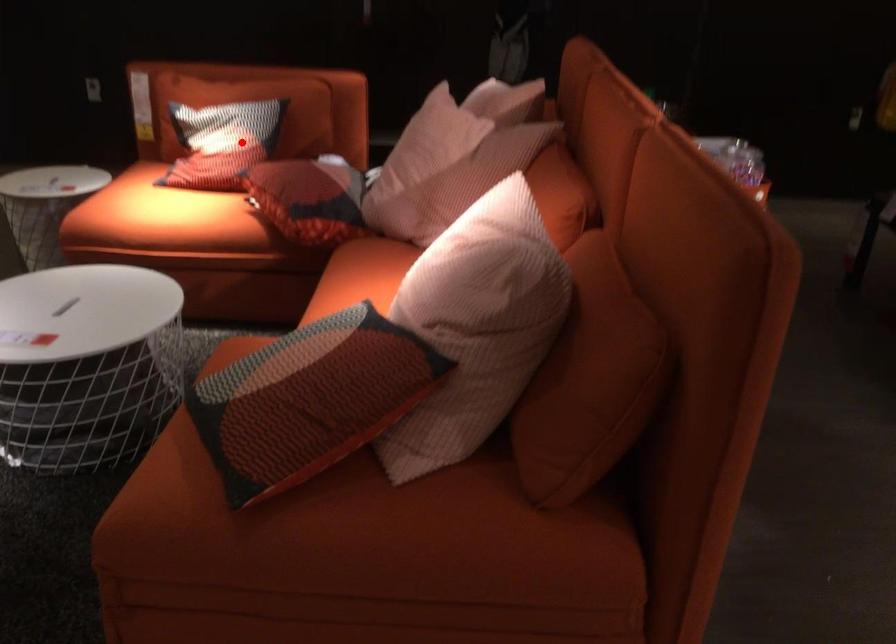
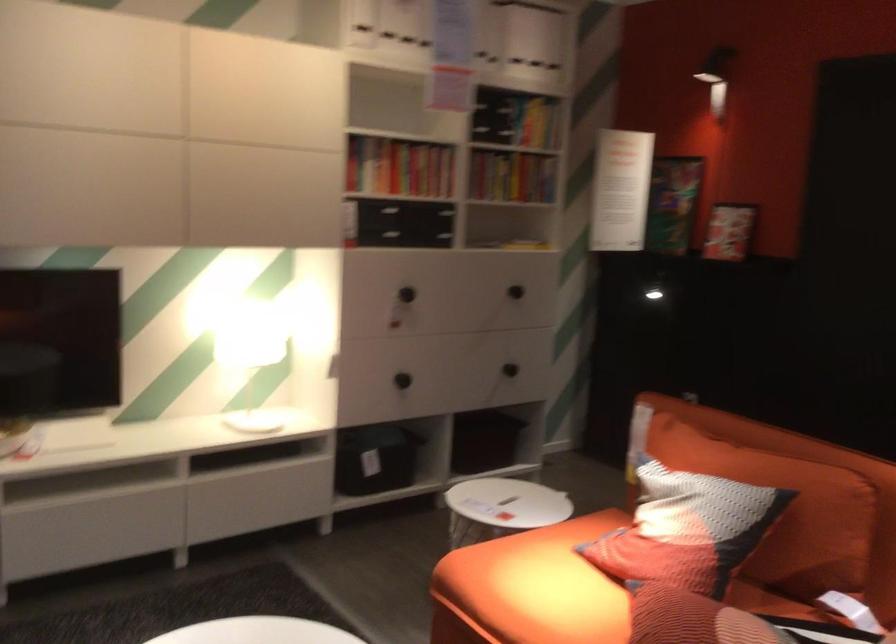
Question: I am providing you with two images of the same scene from different viewpoints. In image1, a red point is highlighted. Considering the same 3D point in image2, which of the following is correct?

Choices:
 (A) It is closer
 (B) It is farther

Answer: (A)